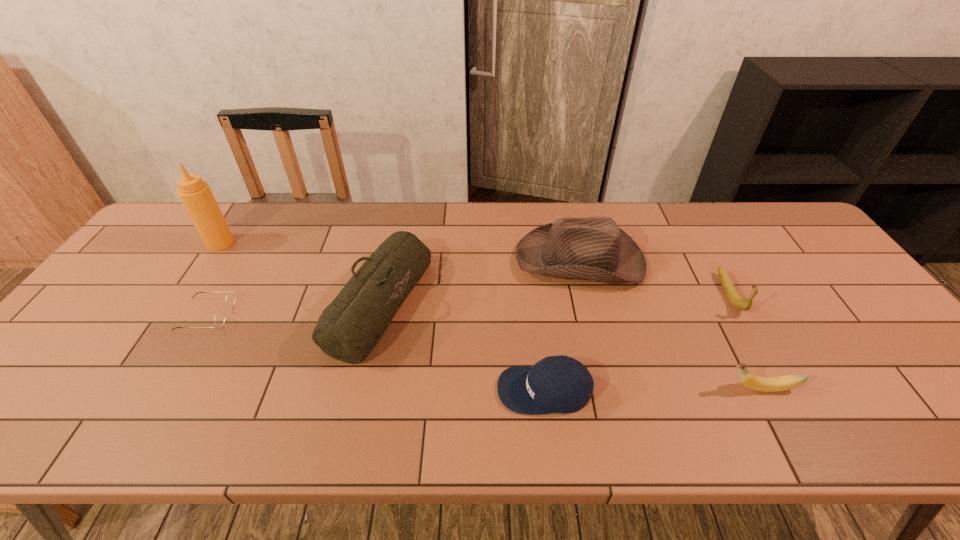
The height and width of the screenshot is (540, 960). Find the location of `vacant space located 0.260m on the back of the fifth object from right to left`. vacant space located 0.260m on the back of the fifth object from right to left is located at coordinates (402, 204).

You are a GUI agent. You are given a task and a screenshot of the screen. Output one action in this format:
    pyautogui.click(x=<x>, y=<y>)
    Task: Click on the vacant space located 0.120m at the stem of the taller banana
    The image size is (960, 540).
    Given the screenshot: What is the action you would take?
    pyautogui.click(x=764, y=356)

At what (x,y) coordinates should I click in order to perform the action: click on free space located at the stem of the nearer banana. Please return your answer as a coordinate pair (x, y). Looking at the image, I should click on (574, 388).

Locate an element on the screen. This screenshot has height=540, width=960. vacant space located 0.200m at the stem of the nearer banana is located at coordinates (632, 388).

This screenshot has width=960, height=540. I want to click on vacant space located at the stem of the nearer banana, so click(645, 388).

This screenshot has height=540, width=960. Find the location of `free space located on the front-facing side of the baseball cap`. free space located on the front-facing side of the baseball cap is located at coordinates click(425, 390).

Identify the location of free spot located 0.350m on the front-facing side of the baseball cap. Image resolution: width=960 pixels, height=540 pixels. (341, 390).

I want to click on vacant space located 0.300m on the front-facing side of the baseball cap, so click(x=363, y=390).

Identify the location of vacant region located on the front-facing side of the shortest object. (303, 315).

Where is `condiment at the far edge`? condiment at the far edge is located at coordinates (195, 194).